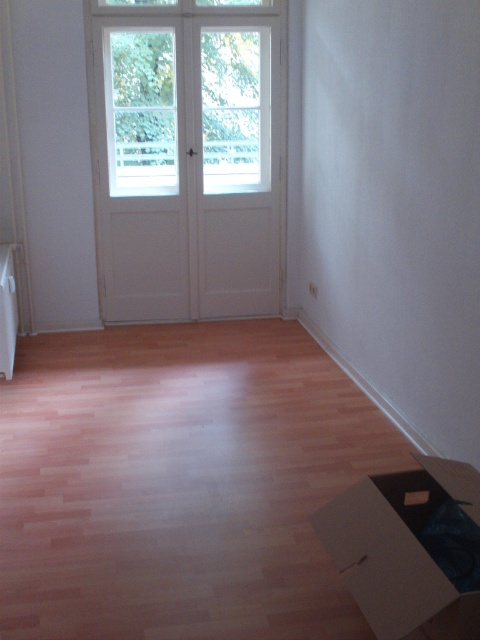
You are moving into a new apartment and need to carry a large brown cardboard box at lower right through the white wooden door at upper center. Based on their positions, can you determine if the box will fit through the door?

The white wooden door at upper center is positioned on the left side of the brown cardboard box at lower right. Since the door is to the left of the box, the box can be maneuvered towards the door for passage, but the actual fit depends on the box dimensions relative to the door opening. However, the spatial arrangement does not indicate any obstruction preventing the box from being moved through the door.

You are standing in the room and want to exit through the white wooden door at upper center. You notice a point marked at coordinates (186, 93). Where is this point located in relation to the white wooden door at upper center?

The point at coordinates (186, 93) is located at the white wooden door at upper center.

You are standing in a room and want to exit through the white wooden door at upper center. If your average walking speed is 3 feet per second, how many seconds will it take you to reach the door?

The white wooden door at upper center is 18.88 feet away. At a walking speed of 3 feet per second, it would take approximately 6.3 seconds to reach the door.